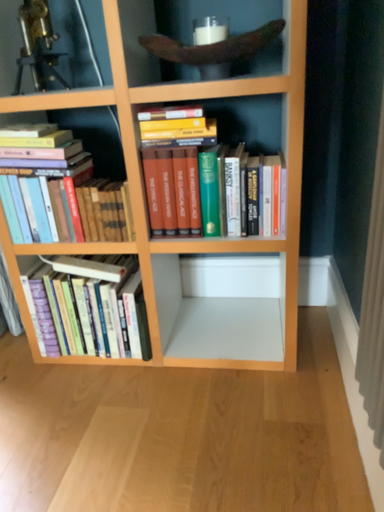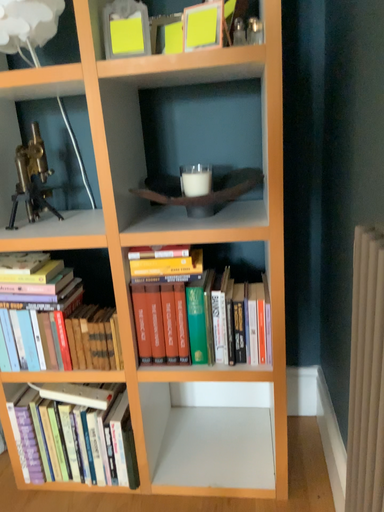
Question: How did the camera likely rotate when shooting the video?

Choices:
 (A) rotated upward
 (B) rotated downward

Answer: (A)